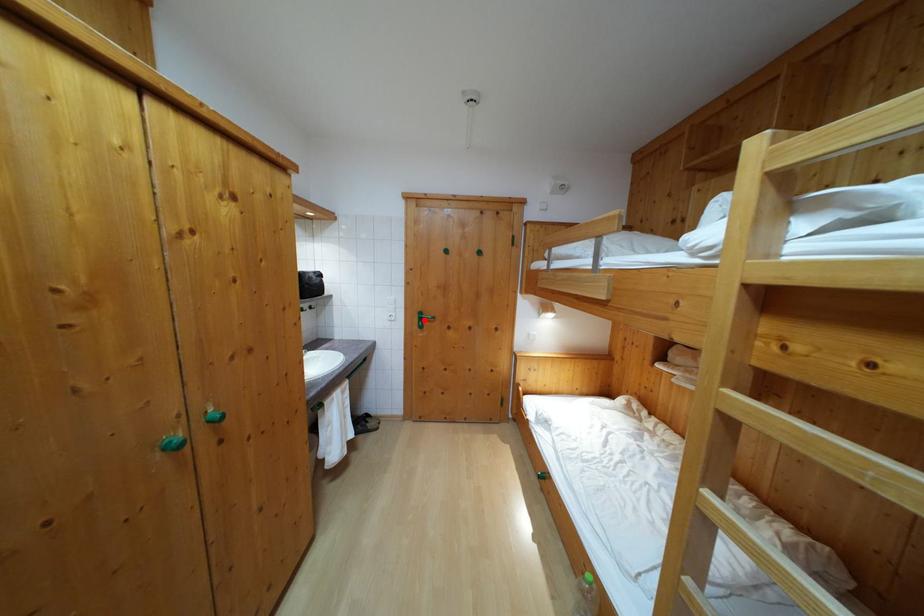
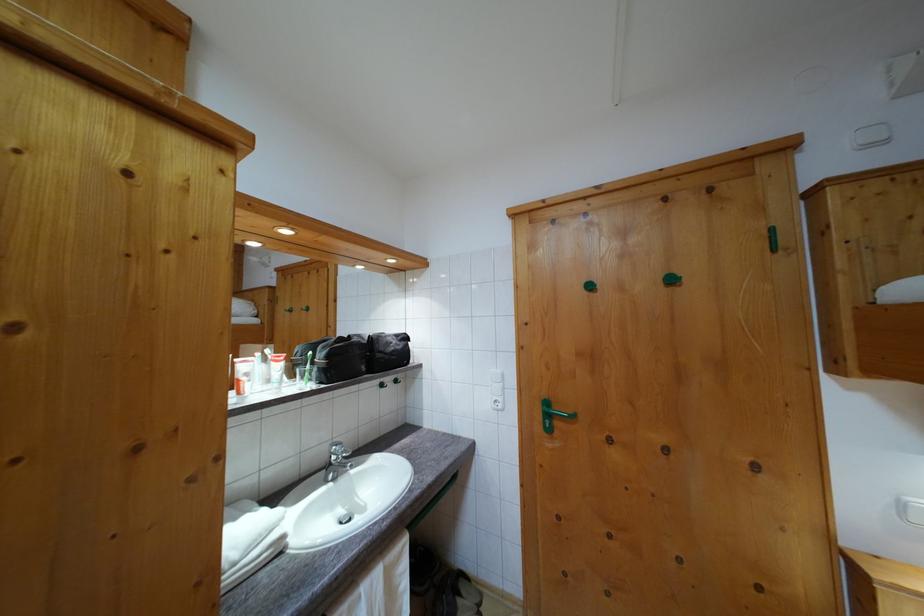
Locate, in the second image, the point that corresponds to the highlighted location in the first image.

(551, 410)